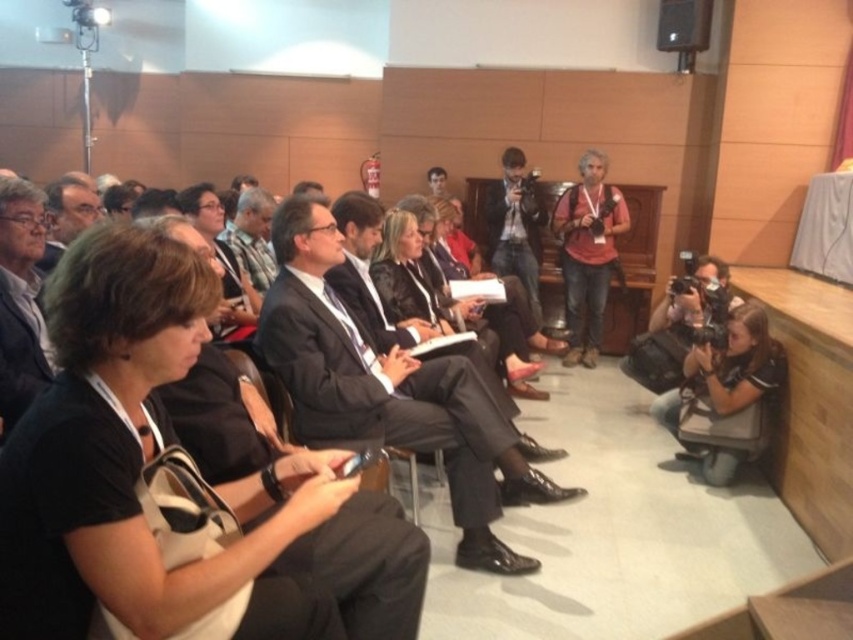
Between matte black camera at center and matte black speaker at upper right, which one appears on the right side from the viewer's perspective?

matte black speaker at upper right is more to the right.

From the picture: Which is below, matte black camera at center or matte black speaker at upper right?

Positioned lower is matte black camera at center.

Looking at this image, who is more distant from viewer, [521,211] or [660,49]?

The point [521,211] is behind.

This screenshot has height=640, width=853. I want to click on matte black camera at center, so click(515, 227).

Does black leather jacket at center have a lesser height compared to matte black camera at center?

Correct, black leather jacket at center is not as tall as matte black camera at center.

Between black leather jacket at center and matte black camera at center, which one is positioned higher?

matte black camera at center

Locate an element on the screen. black leather jacket at center is located at coordinates (473, 300).

Can you confirm if matte black suit at center is bigger than matte black camera at center?

No, matte black suit at center is not bigger than matte black camera at center.

In the scene shown: Can you confirm if matte black suit at center is positioned above matte black camera at center?

Actually, matte black suit at center is below matte black camera at center.

Who is more forward, (45, 385) or (511, 273)?

Point (45, 385) is more forward.

Identify the location of matte black suit at center. (21, 300).